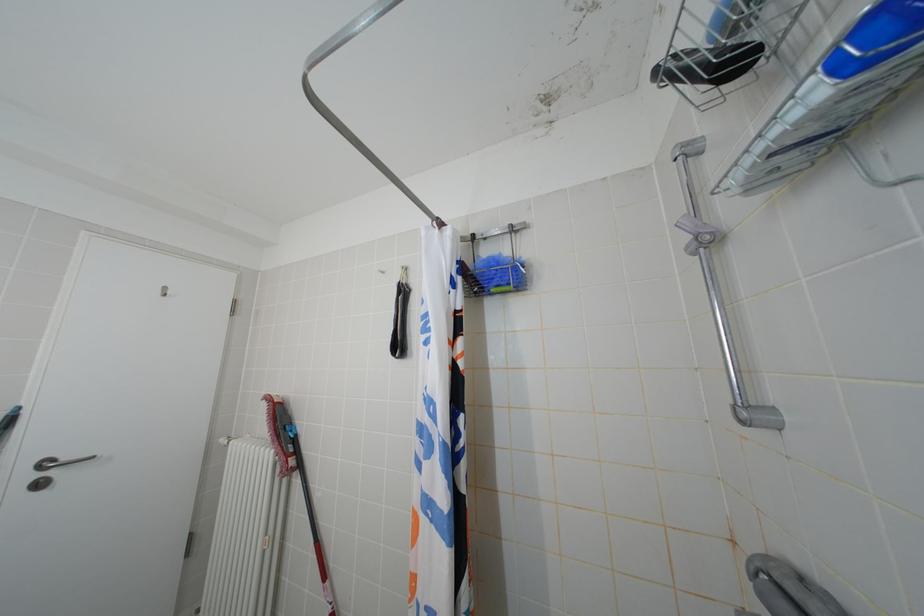
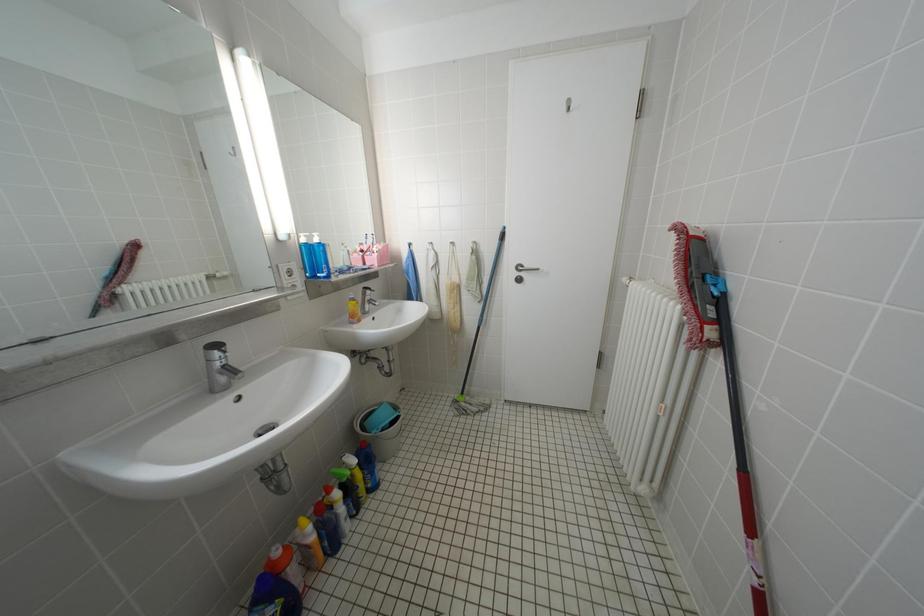
How did the camera likely rotate?

The rotation direction of the camera is left-down.